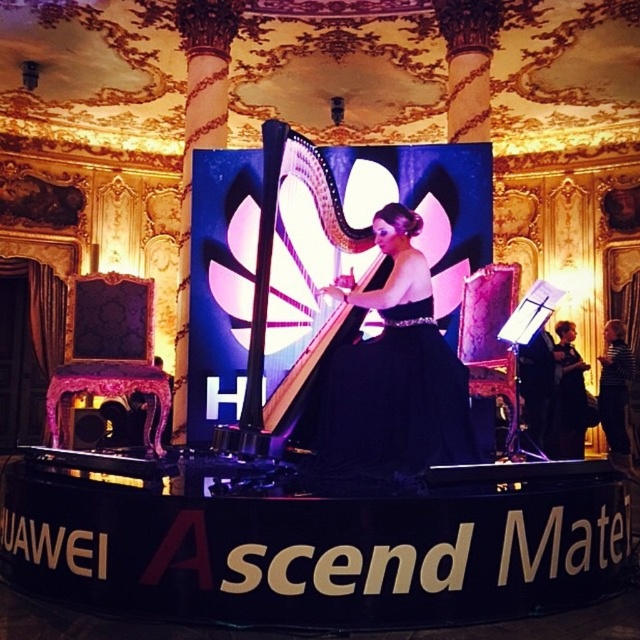
You are a photographer at this event and want to capture a photo of the shiny silver harp at center and the black satin dress at center. Which object should you focus on first if you want to highlight the harp in the foreground?

The shiny silver harp at center should be focused on first since it is closer to the photographer than the black satin dress at center, which is positioned to its right.

You are a photographer who needs to capture a closeup of the shiny silver harp at center without including the black satin dress at center in the shot. Given the spatial relationship between them, is this possible?

The black satin dress at center is bigger than the shiny silver harp at center, so the dress may be blocking the harp, making it difficult to capture the harp without including the dress in the shot.

You are standing in the center of the room and see two points marked on the floor. The first point is at coordinate point(x=445, y=374) and the second is at point(x=308, y=180). Which point is closer to you?

Point(x=445, y=374) is in front of point(x=308, y=180), so it is closer to you.